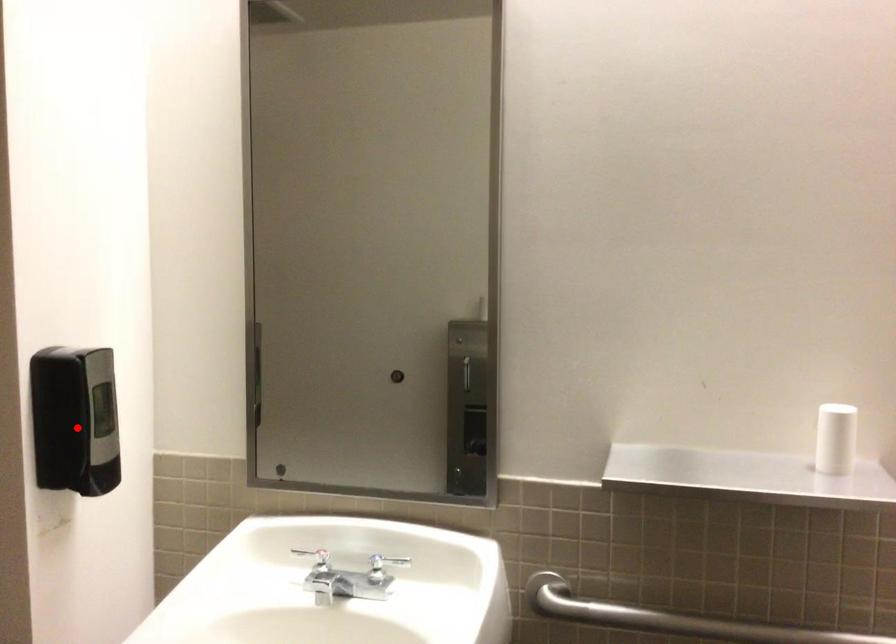
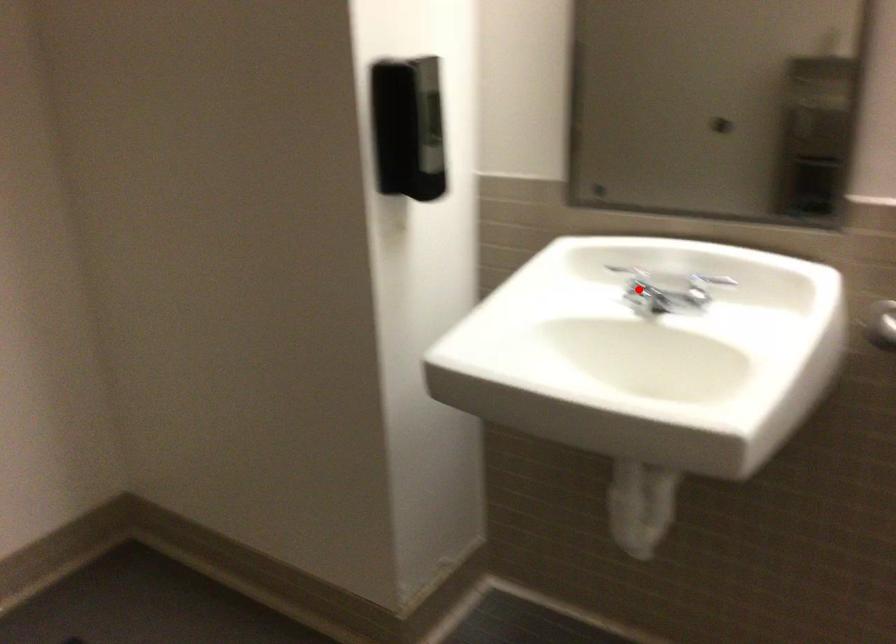
I am providing you with two images of the same scene from different viewpoints. A red point is marked on the first image and another point is marked on the second image. Do the highlighted points in image1 and image2 indicate the same real-world spot?

No